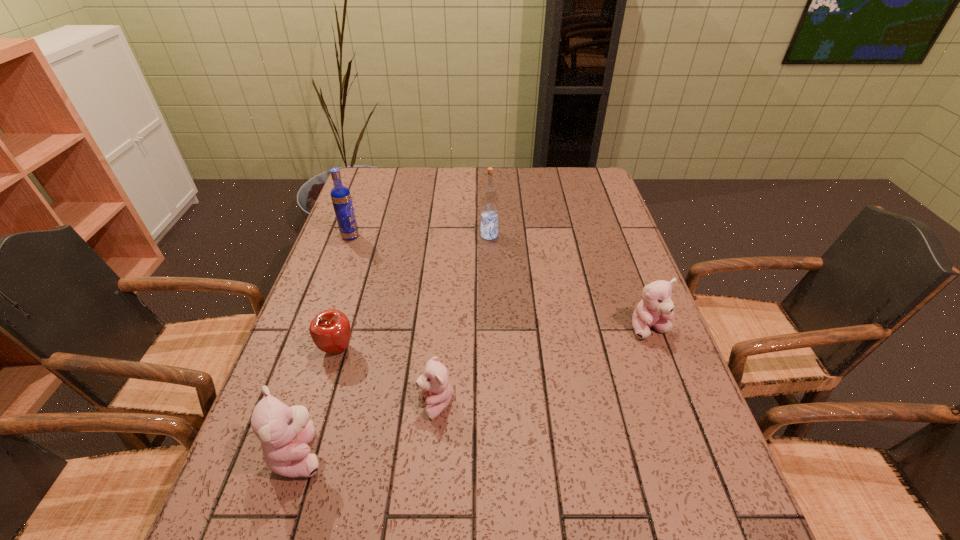
Locate an element on the screen. empty location between the leftmost teddy bear and the fifth farthest object is located at coordinates (368, 429).

Find the location of `free spot between the nearest teddy bear and the second nearest object`. free spot between the nearest teddy bear and the second nearest object is located at coordinates (368, 429).

The height and width of the screenshot is (540, 960). Identify the location of free point between the second nearest object and the fifth object from left to right. (463, 320).

In order to click on free space between the second teddy bear from left to right and the right vodka in this screenshot , I will do `click(463, 320)`.

Where is `free spot between the right vodka and the second nearest teddy bear`? The image size is (960, 540). free spot between the right vodka and the second nearest teddy bear is located at coordinates (463, 320).

In order to click on empty location between the second tallest teddy bear and the apple in this screenshot , I will do `click(493, 339)`.

I want to click on vacant region between the left vodka and the second tallest teddy bear, so click(500, 282).

Point out which object is positioned as the fifth nearest to the left vodka. Please provide its 2D coordinates. Your answer should be formatted as a tuple, i.e. [(x, y)], where the tuple contains the x and y coordinates of a point satisfying the conditions above.

[(655, 309)]

The height and width of the screenshot is (540, 960). Identify the location of object that stands as the second closest to the left vodka. (489, 199).

The image size is (960, 540). I want to click on teddy bear that is the second closest to the second tallest teddy bear, so tap(285, 432).